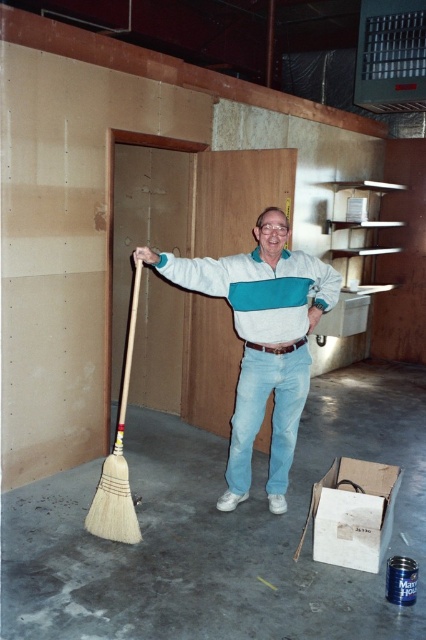
Does white cotton sweater at center have a greater height compared to white bristle broom at lower left?

Correct, white cotton sweater at center is much taller as white bristle broom at lower left.

Who is more forward, (268, 380) or (115, 531)?

Point (115, 531)

The width and height of the screenshot is (426, 640). I want to click on white cotton sweater at center, so click(261, 340).

Which is more to the right, natural wood broom at center or white bristle broom at lower left?

Positioned to the right is natural wood broom at center.

Is natural wood broom at center above white bristle broom at lower left?

No.

Is point (189, 531) farther from viewer compared to point (115, 445)?

Yes, it is.

Identify the location of natural wood broom at center. The image size is (426, 640). (219, 532).

The width and height of the screenshot is (426, 640). Describe the element at coordinates (219, 532) in the screenshot. I see `natural wood broom at center` at that location.

Is point (397, 412) farther from viewer compared to point (241, 330)?

Yes.

Is point (89, 596) positioned after point (253, 256)?

No, (89, 596) is in front of (253, 256).

This screenshot has width=426, height=640. Identify the location of natural wood broom at center. (219, 532).